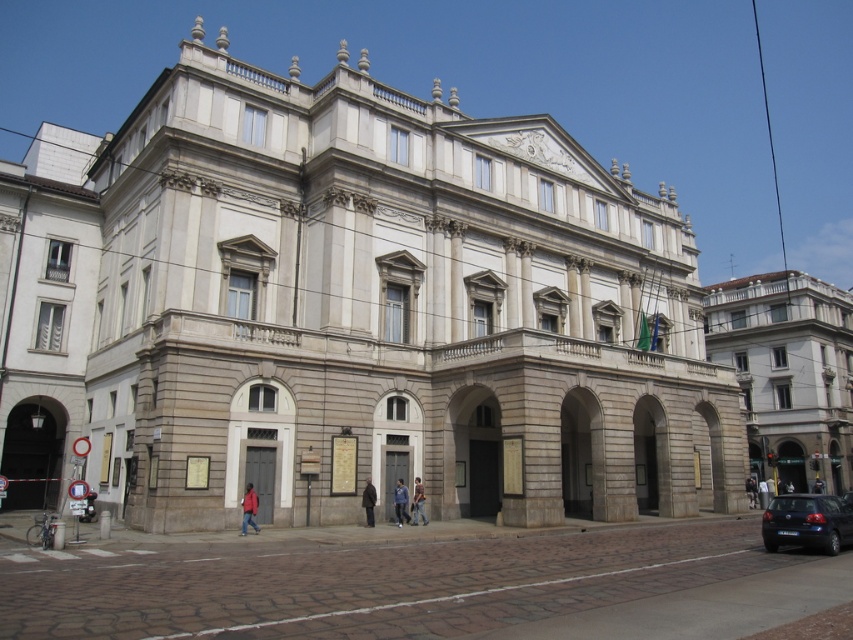
You are standing at the entrance of the grand neoclassical building and notice a denim jacket at center. Where is the denim jacket located in relation to the entrance?

The denim jacket at center is located at point (399,502) in 2D coordinates relative to the entrance.

You are a visitor entering the grand neoclassical building and notice two items at the entrance. You see a dark gray coat at center and a dark blue jacket at center. Which item is narrower in width?

The dark gray coat at center is narrower in width compared to the dark blue jacket at center.

You are a photographer standing at the entrance of the grand neoclassical building. You notice a red jacket at lower left and a dark gray coat at center. Which clothing item is wider?

The red jacket at lower left is wider than the dark gray coat at center.